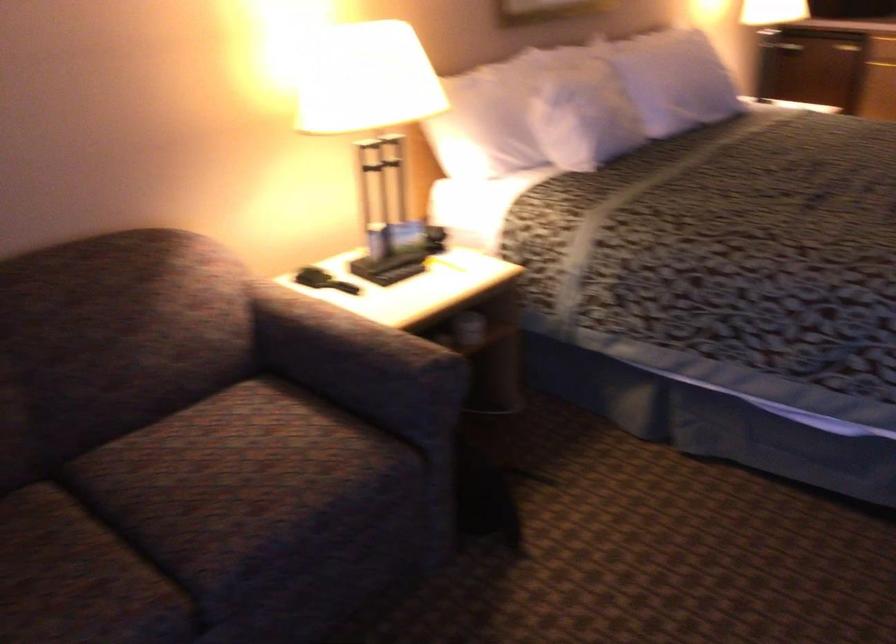
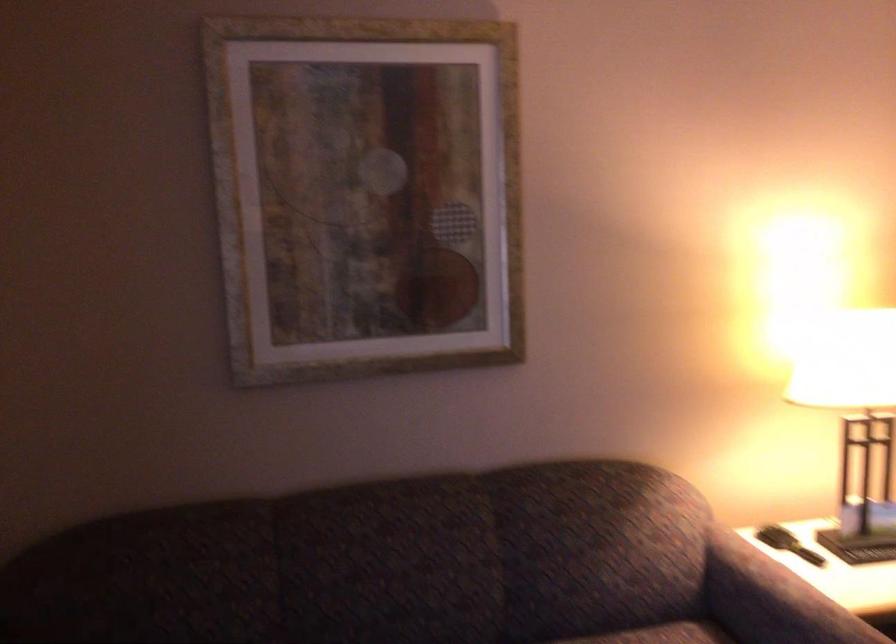
Question: The first image is from the beginning of the video and the second image is from the end. How did the camera likely rotate when shooting the video?

Choices:
 (A) Left
 (B) Right
 (C) Up
 (D) Down

Answer: (A)